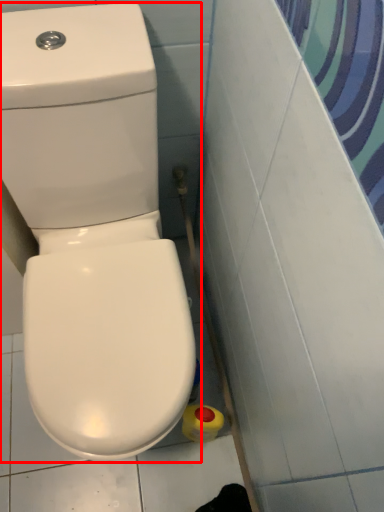
Question: Observing the image, what is the correct spatial positioning of toilet (annotated by the red box) in reference to cleaning product?

Choices:
 (A) right
 (B) left

Answer: (B)